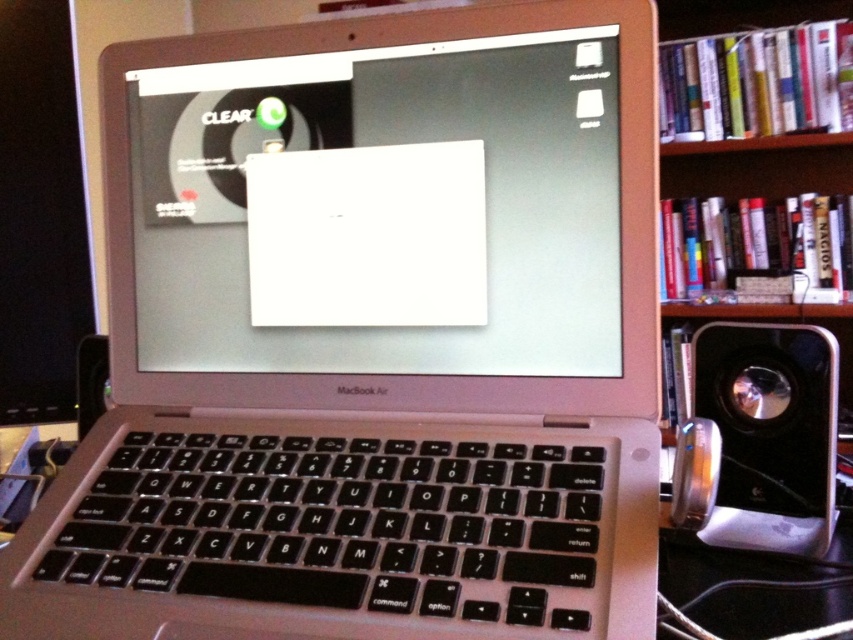
Which is above, white matte paper at center or metallic silver speaker at lower left?

white matte paper at center is above.

Between white matte paper at center and metallic silver speaker at lower left, which one has more height?

Standing taller between the two is white matte paper at center.

I want to click on white matte paper at center, so click(x=344, y=220).

Locate an element on the screen. white matte paper at center is located at coordinates pyautogui.click(x=344, y=220).

Between wooden bookshelf at right and metallic silver speaker at lower left, which one has more height?

wooden bookshelf at right

Is point (804, 81) positioned behind point (86, 372)?

That is True.

You are a GUI agent. You are given a task and a screenshot of the screen. Output one action in this format:
    pyautogui.click(x=<x>, y=<y>)
    Task: Click on the wooden bookshelf at right
    The height and width of the screenshot is (640, 853).
    Given the screenshot: What is the action you would take?
    pyautogui.click(x=746, y=150)

Can you confirm if white matte paper at center is positioned below black plastic speaker at lower right?

Incorrect, white matte paper at center is not positioned below black plastic speaker at lower right.

Who is higher up, white matte paper at center or black plastic speaker at lower right?

Positioned higher is white matte paper at center.

Is point (154, 355) closer to camera compared to point (708, 417)?

Yes, it is in front of point (708, 417).

Find the location of `white matte paper at center`. white matte paper at center is located at coordinates (344, 220).